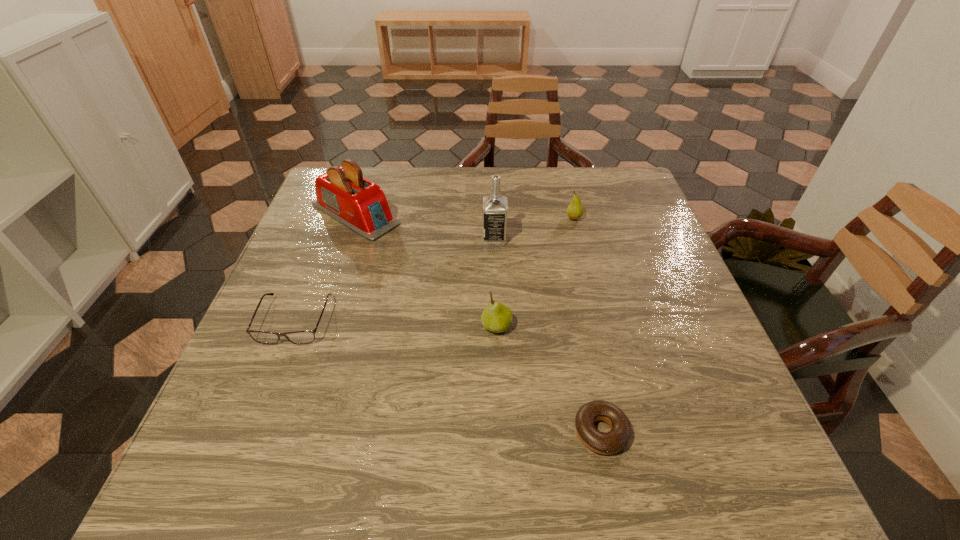
At what (x,y) coordinates should I click in order to perform the action: click on free space at the left edge of the desktop. Please return your answer as a coordinate pair (x, y). Looking at the image, I should click on (324, 228).

This screenshot has height=540, width=960. What are the coordinates of `vacant area at the right edge of the desktop` in the screenshot? It's located at (646, 370).

In the image, there is a desktop. Identify the location of free region at the near left corner. This screenshot has height=540, width=960. (202, 456).

Find the location of a particular element. The height and width of the screenshot is (540, 960). vacant space at the far right corner is located at coordinates (597, 188).

This screenshot has height=540, width=960. Identify the location of empty space that is in between the doughnut and the vodka. (547, 335).

The image size is (960, 540). In order to click on empty space between the farther pear and the fifth shortest object in this screenshot , I will do `click(465, 217)`.

Locate an element on the screen. The height and width of the screenshot is (540, 960). free space between the tallest object and the farther pear is located at coordinates (534, 229).

I want to click on free space between the toaster and the left pear, so click(x=426, y=270).

The height and width of the screenshot is (540, 960). What are the coordinates of `vacant area that lies between the nearest object and the vodka` in the screenshot? It's located at (547, 335).

This screenshot has height=540, width=960. Find the location of `unoccupied position between the fifth shortest object and the left pear`. unoccupied position between the fifth shortest object and the left pear is located at coordinates (426, 270).